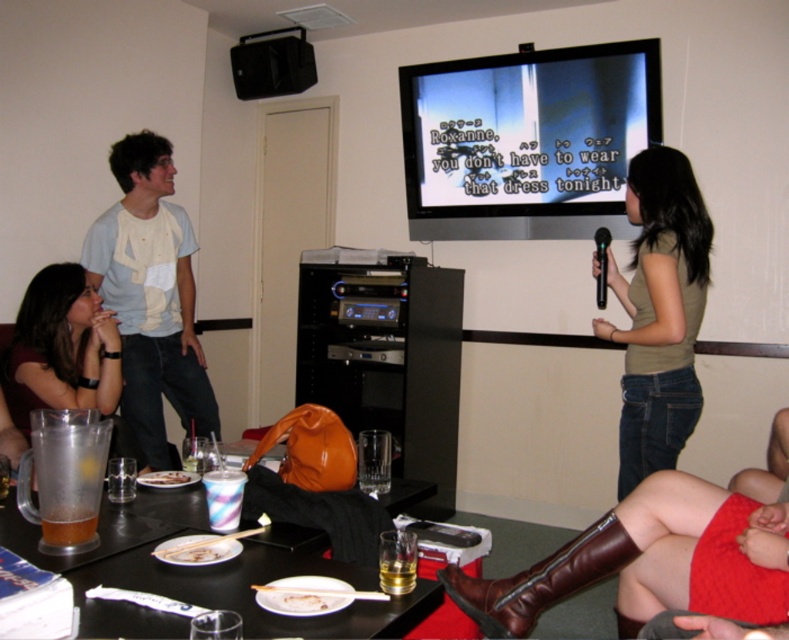
You are a photographer taking a picture of the karaoke scene. You need to ensure both the white cotton shirt at upper left and the matte green tank top at center are clearly visible. Which one should you focus on first to avoid blurring due to their sizes?

The white cotton shirt at upper left has a greater height compared to matte green tank top at center, so focusing on the taller white cotton shirt at upper left first would ensure it is in focus before adjusting for the smaller matte green tank top at center.

You are a photographer taking a picture of the karaoke scene. You want to ensure both the white cotton shirt at upper left and the matte green tank top at center are visible in the frame. Based on their positions, which one should you focus on first to capture both in the shot?

The white cotton shirt at upper left is to the left of the matte green tank top at center, so focusing on the matte green tank top at center first would allow both to be captured in the frame since the white cotton shirt at upper left is positioned to its left.

You are standing in the room and want to place a small plant on the coffee table. The white cotton shirt at upper left is currently at coordinates point 0.463, 0.193. Where should you place the plant to avoid blocking the view of the shirt?

Place the plant on the coffee table in a position that does not obstruct the view of the white cotton shirt at upper left, which is located at coordinates point (151, 296).